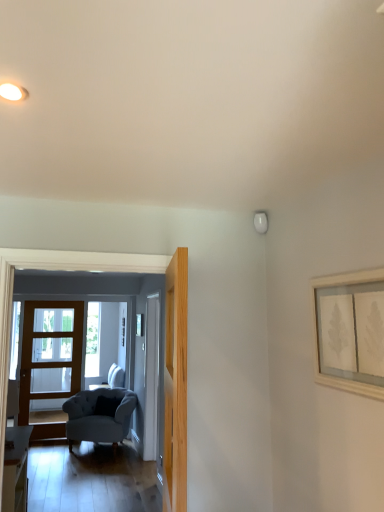
What is the approximate width of light wood door at center, arranged as the 3th door when viewed from the back?

It is 5.93 inches.

What do you see at coordinates (350, 331) in the screenshot? This screenshot has height=512, width=384. I see `wooden framed picture at upper right` at bounding box center [350, 331].

Identify the location of wooden glass door at left, which ranks as the first door in back-to-front order. The width and height of the screenshot is (384, 512). (51, 351).

This screenshot has height=512, width=384. I want to click on light gray fabric armchair at left, so (x=108, y=271).

In terms of size, does light gray fabric armchair at left appear bigger or smaller than suede-like gray armchair at lower left?

Considering their sizes, light gray fabric armchair at left takes up less space than suede-like gray armchair at lower left.

From the image's perspective, between light gray fabric armchair at left and suede-like gray armchair at lower left, which one is located above?

light gray fabric armchair at left, from the image's perspective.

Can suede-like gray armchair at lower left be found inside light gray fabric armchair at left?

That's incorrect, suede-like gray armchair at lower left is not inside light gray fabric armchair at left.

Is light gray fabric armchair at left further to camera compared to suede-like gray armchair at lower left?

No.

From the picture: Considering the positions of objects light gray fabric armchair at left and white glossy door at center, the second door from the back, in the image provided, who is more to the left, light gray fabric armchair at left or white glossy door at center, the second door from the back,?

light gray fabric armchair at left is more to the left.

Who is bigger, light gray fabric armchair at left or white glossy door at center, arranged as the 2th door when viewed from the left?

white glossy door at center, arranged as the 2th door when viewed from the left.

Image resolution: width=384 pixels, height=512 pixels. In order to click on the 1st door behind the light gray fabric armchair at left, starting your count from the anchor in this screenshot , I will do `click(151, 377)`.

Is white glossy door at center, the 2th door from the front, oriented towards wooden framed picture at upper right?

No, white glossy door at center, the 2th door from the front, is not facing towards wooden framed picture at upper right.

Who is shorter, white glossy door at center, the second door from the back, or wooden framed picture at upper right?

Standing shorter between the two is wooden framed picture at upper right.

From the image's perspective, relative to wooden framed picture at upper right, is white glossy door at center, arranged as the 2th door when viewed from the left, above or below?

white glossy door at center, arranged as the 2th door when viewed from the left, is situated lower than wooden framed picture at upper right in the image.

From a real-world perspective, is white glossy door at center, which ranks as the second door in right-to-left order, on wooden framed picture at upper right?

Incorrect, from a real-world perspective, white glossy door at center, which ranks as the second door in right-to-left order, is lower than wooden framed picture at upper right.

Would you say light gray fabric armchair at left is to the left or to the right of wooden framed picture at upper right in the picture?

light gray fabric armchair at left is to the left of wooden framed picture at upper right.

Between point (177, 502) and point (378, 274), which one is positioned behind?

The point (177, 502) is farther from the camera.

Is light gray fabric armchair at left inside or outside of wooden framed picture at upper right?

light gray fabric armchair at left is not enclosed by wooden framed picture at upper right.

From the image's perspective, between light gray fabric armchair at left and wooden framed picture at upper right, which one is located above?

wooden framed picture at upper right.

Considering the relative sizes of light gray fabric armchair at left and wooden glass door at left, which ranks as the 1th door in left-to-right order, in the image provided, is light gray fabric armchair at left smaller than wooden glass door at left, which ranks as the 1th door in left-to-right order,?

Actually, light gray fabric armchair at left might be larger than wooden glass door at left, which ranks as the 1th door in left-to-right order.

Based on the photo, which is in front, light gray fabric armchair at left or wooden glass door at left, which ranks as the first door in back-to-front order?

light gray fabric armchair at left.

Who is shorter, light gray fabric armchair at left or wooden glass door at left, arranged as the 3th door when viewed from the right?

light gray fabric armchair at left is shorter.

Can you confirm if wooden framed picture at upper right is taller than light gray fabric armchair at left?

In fact, wooden framed picture at upper right may be shorter than light gray fabric armchair at left.

Is wooden framed picture at upper right to the left or to the right of light gray fabric armchair at left in the image?

wooden framed picture at upper right is positioned on light gray fabric armchair at left's right side.

Based on the photo, from the image's perspective, would you say wooden framed picture at upper right is positioned over light gray fabric armchair at left?

Yes.

Locate an element on the screen. This screenshot has height=512, width=384. residence that appears below the wooden framed picture at upper right (from the image's perspective) is located at coordinates (108, 271).

Is suede-like gray armchair at lower left turned away from light gray fabric armchair at left?

No, suede-like gray armchair at lower left is not facing the opposite direction of light gray fabric armchair at left.

From the image's perspective, is suede-like gray armchair at lower left located above or below light gray fabric armchair at left?

Clearly, from the image's perspective, suede-like gray armchair at lower left is below light gray fabric armchair at left.

Can you tell me how much suede-like gray armchair at lower left and light gray fabric armchair at left differ in facing direction?

The angle between the facing direction of suede-like gray armchair at lower left and the facing direction of light gray fabric armchair at left is 28.1 degrees.

The width and height of the screenshot is (384, 512). Identify the location of chair behind the light gray fabric armchair at left. (99, 415).

From the image's perspective, which door is the 1st one below the light gray fabric armchair at left? Please provide its 2D coordinates.

[(151, 377)]

Considering their positions, is light wood door at center, acting as the first door starting from the right, positioned further to wooden framed picture at upper right than white glossy door at center, which ranks as the second door in right-to-left order?

white glossy door at center, which ranks as the second door in right-to-left order, lies further to wooden framed picture at upper right than the other object.

Considering their positions, is suede-like gray armchair at lower left positioned closer to wooden framed picture at upper right than light gray fabric armchair at left?

Among the two, light gray fabric armchair at left is located nearer to wooden framed picture at upper right.

Which object lies further to the anchor point wooden glass door at left, which ranks as the first door in back-to-front order, white glossy door at center, which ranks as the second door in right-to-left order, or light gray fabric armchair at left?

light gray fabric armchair at left.

Looking at the image, which one is located further to white glossy door at center, the second door from the back, wooden framed picture at upper right or light gray fabric armchair at left?

wooden framed picture at upper right.

Looking at the image, which one is located closer to light gray fabric armchair at left, suede-like gray armchair at lower left or wooden framed picture at upper right?

wooden framed picture at upper right is closer to light gray fabric armchair at left.

From the image, which object appears to be nearer to light wood door at center, arranged as the 3th door when viewed from the back, light gray fabric armchair at left or wooden glass door at left, marked as the third door in a front-to-back arrangement?

Based on the image, light gray fabric armchair at left appears to be nearer to light wood door at center, arranged as the 3th door when viewed from the back.

Considering their positions, is wooden glass door at left, which ranks as the first door in back-to-front order, positioned closer to light wood door at center, arranged as the 3th door when viewed from the back, than light gray fabric armchair at left?

Among the two, light gray fabric armchair at left is located nearer to light wood door at center, arranged as the 3th door when viewed from the back.

Based on their spatial positions, is wooden framed picture at upper right or light wood door at center, the first door viewed from the front, closer to white glossy door at center, arranged as the 2th door when viewed from the left?

Among the two, light wood door at center, the first door viewed from the front, is located nearer to white glossy door at center, arranged as the 2th door when viewed from the left.

Where is `door between light gray fabric armchair at left and wooden glass door at left, which ranks as the first door in back-to-front order, from front to back`? The width and height of the screenshot is (384, 512). door between light gray fabric armchair at left and wooden glass door at left, which ranks as the first door in back-to-front order, from front to back is located at coordinates (151, 377).

I want to click on residence between wooden framed picture at upper right and white glossy door at center, the second door from the back, from front to back, so click(108, 271).

Locate an element on the screen. residence located between light wood door at center, acting as the first door starting from the right, and white glossy door at center, arranged as the 2th door when viewed from the left, in the depth direction is located at coordinates (108, 271).

This screenshot has height=512, width=384. In order to click on residence positioned between wooden framed picture at upper right and wooden glass door at left, which ranks as the first door in back-to-front order, from near to far in this screenshot , I will do `click(108, 271)`.